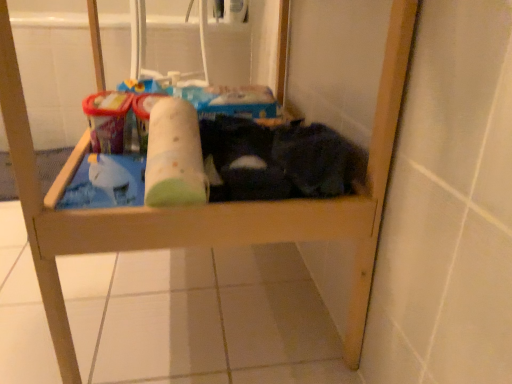
Measure the distance between point (275, 145) and camera.

Point (275, 145) and camera are 30.71 inches apart from each other.

At what (x,y) coordinates should I click in order to perform the action: click on dark fabric laundry at lower right. Please return your answer as a coordinate pair (x, y). This screenshot has height=384, width=512. Looking at the image, I should click on (277, 159).

What do you see at coordinates (277, 159) in the screenshot? I see `dark fabric laundry at lower right` at bounding box center [277, 159].

At what (x,y) coordinates should I click in order to perform the action: click on green fabric toilet paper at center. Please return your answer as a coordinate pair (x, y). The width and height of the screenshot is (512, 384). Looking at the image, I should click on (174, 156).

The height and width of the screenshot is (384, 512). What do you see at coordinates (174, 156) in the screenshot?
I see `green fabric toilet paper at center` at bounding box center [174, 156].

Where is `dark fabric laundry at lower right`? dark fabric laundry at lower right is located at coordinates (x=277, y=159).

Does green fabric toilet paper at center appear on the left side of dark fabric laundry at lower right?

Yes.

Is green fabric toilet paper at center closer to the viewer compared to dark fabric laundry at lower right?

Yes, green fabric toilet paper at center is closer to the viewer.

Which point is more forward, [192,112] or [333,131]?

Positioned in front is point [192,112].

From the image's perspective, is green fabric toilet paper at center located above or below dark fabric laundry at lower right?

Clearly, from the image's perspective, green fabric toilet paper at center is below dark fabric laundry at lower right.

Based on the photo, from a real-world perspective, is green fabric toilet paper at center physically located above or below dark fabric laundry at lower right?

green fabric toilet paper at center is situated higher than dark fabric laundry at lower right in the real world.

Is green fabric toilet paper at center wider than dark fabric laundry at lower right?

Incorrect, the width of green fabric toilet paper at center does not surpass that of dark fabric laundry at lower right.

Looking at this image, can you confirm if green fabric toilet paper at center is shorter than dark fabric laundry at lower right?

Indeed, green fabric toilet paper at center has a lesser height compared to dark fabric laundry at lower right.

Looking at the image, does green fabric toilet paper at center seem bigger or smaller compared to dark fabric laundry at lower right?

Clearly, green fabric toilet paper at center is smaller in size than dark fabric laundry at lower right.

Which is correct: green fabric toilet paper at center is inside dark fabric laundry at lower right, or outside of it?

green fabric toilet paper at center is located beyond the bounds of dark fabric laundry at lower right.

Can you see green fabric toilet paper at center touching dark fabric laundry at lower right?

No, green fabric toilet paper at center is not touching dark fabric laundry at lower right.

Is green fabric toilet paper at center oriented towards dark fabric laundry at lower right?

No, green fabric toilet paper at center is not turned towards dark fabric laundry at lower right.

How different are the orientations of green fabric toilet paper at center and dark fabric laundry at lower right in degrees?

The angular difference between green fabric toilet paper at center and dark fabric laundry at lower right is 92.1 degrees.

Where is `toilet paper that is above the dark fabric laundry at lower right (from a real-world perspective)`? Image resolution: width=512 pixels, height=384 pixels. toilet paper that is above the dark fabric laundry at lower right (from a real-world perspective) is located at coordinates (174, 156).

Considering the positions of objects dark fabric laundry at lower right and green fabric toilet paper at center in the image provided, who is more to the left, dark fabric laundry at lower right or green fabric toilet paper at center?

green fabric toilet paper at center.

Is the depth of dark fabric laundry at lower right greater than that of green fabric toilet paper at center?

Yes.

Does point (325, 174) lie behind point (169, 204)?

Yes.

From the image's perspective, is dark fabric laundry at lower right above or below green fabric toilet paper at center?

Clearly, from the image's perspective, dark fabric laundry at lower right is above green fabric toilet paper at center.

Based on the photo, from a real-world perspective, is dark fabric laundry at lower right above or below green fabric toilet paper at center?

Clearly, from a real-world perspective, dark fabric laundry at lower right is below green fabric toilet paper at center.

From the picture: Can you confirm if dark fabric laundry at lower right is wider than green fabric toilet paper at center?

Correct, the width of dark fabric laundry at lower right exceeds that of green fabric toilet paper at center.

Looking at this image, is dark fabric laundry at lower right taller or shorter than green fabric toilet paper at center?

Clearly, dark fabric laundry at lower right is taller compared to green fabric toilet paper at center.

Between dark fabric laundry at lower right and green fabric toilet paper at center, which one has larger size?

dark fabric laundry at lower right is bigger.

Do you think dark fabric laundry at lower right is within green fabric toilet paper at center, or outside of it?

dark fabric laundry at lower right is spatially situated outside green fabric toilet paper at center.

Is there a large distance between dark fabric laundry at lower right and green fabric toilet paper at center?

No.

Is dark fabric laundry at lower right facing away from green fabric toilet paper at center?

No, dark fabric laundry at lower right is not facing the opposite direction of green fabric toilet paper at center.

What's the angular difference between dark fabric laundry at lower right and green fabric toilet paper at center's facing directions?

The facing directions of dark fabric laundry at lower right and green fabric toilet paper at center are 92.1 degrees apart.

Where is `toilet paper located below the dark fabric laundry at lower right (from the image's perspective)`? This screenshot has height=384, width=512. toilet paper located below the dark fabric laundry at lower right (from the image's perspective) is located at coordinates (174, 156).

Image resolution: width=512 pixels, height=384 pixels. What are the coordinates of `laundry behind the green fabric toilet paper at center` in the screenshot? It's located at (277, 159).

At what (x,y) coordinates should I click in order to perform the action: click on laundry on the right side of green fabric toilet paper at center. Please return your answer as a coordinate pair (x, y). This screenshot has height=384, width=512. Looking at the image, I should click on (277, 159).